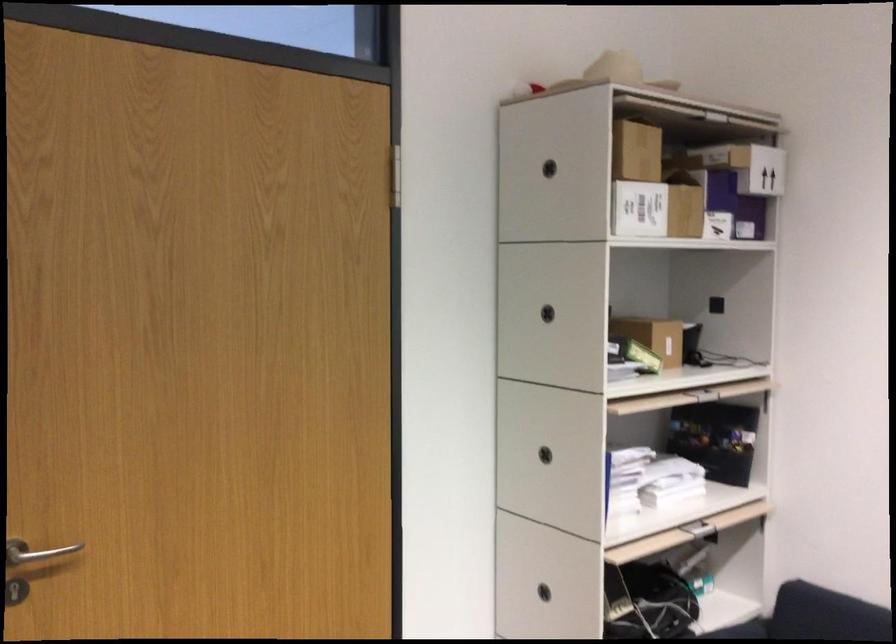
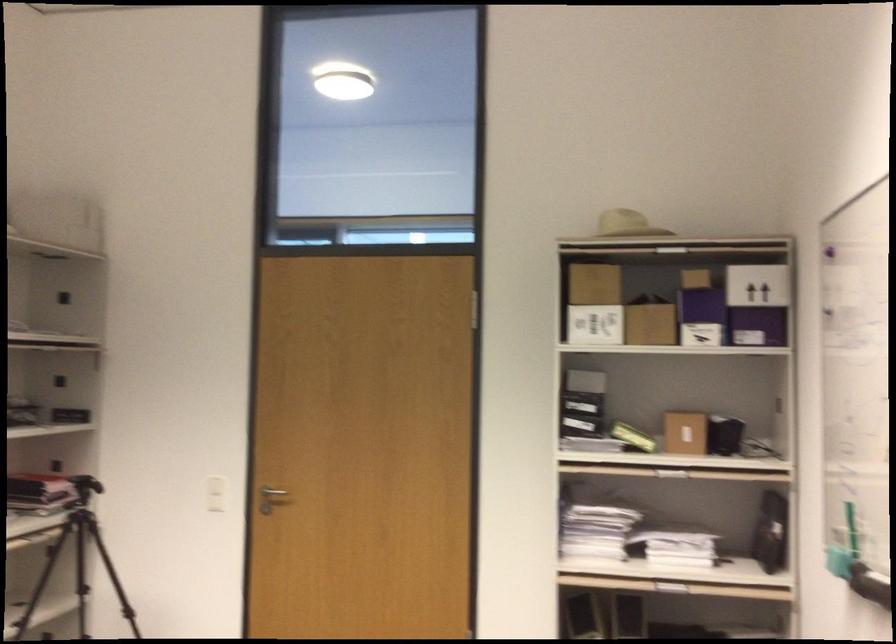
Question: I am providing you with two images of the same scene from different viewpoints. After the viewpoint changes to image2, which objects are now occluded?

Choices:
 (A) white box with arrows
 (B) green board eraser
 (C) purple box
 (D) none of these

Answer: (D)